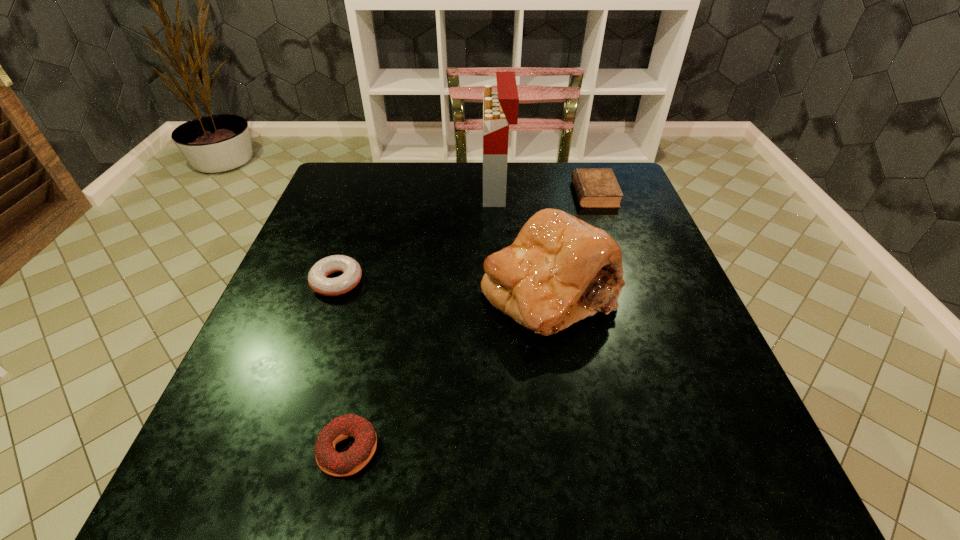
This screenshot has height=540, width=960. I want to click on empty space that is in between the fourth object from right to left and the diary, so click(471, 321).

Image resolution: width=960 pixels, height=540 pixels. I want to click on vacant point located between the leftmost object and the bread, so point(444,287).

Locate an element on the screen. vacant area that lies between the left doughnut and the second object from left to right is located at coordinates (343, 366).

In order to click on unoccupied position between the tallest object and the diary in this screenshot , I will do `click(545, 191)`.

I want to click on blank region between the diary and the cigarette case, so click(545, 191).

Locate an element on the screen. free spot between the left doughnut and the diary is located at coordinates (466, 238).

Locate an element on the screen. This screenshot has height=540, width=960. object that is the fourth closest one to the tallest object is located at coordinates (349, 462).

Where is `object that is the third closest to the right doughnut`? object that is the third closest to the right doughnut is located at coordinates coord(500,108).

Identify the location of free point that satisfies the following two spatial constraints: 1. on the spine side of the diary; 2. on the filling side of the bread. click(x=629, y=292).

Where is `vacant position in the image that satisfies the following two spatial constraints: 1. with the lid open on the cigarette case; 2. on the front side of the nearer doughnut`? The height and width of the screenshot is (540, 960). vacant position in the image that satisfies the following two spatial constraints: 1. with the lid open on the cigarette case; 2. on the front side of the nearer doughnut is located at coordinates (511, 449).